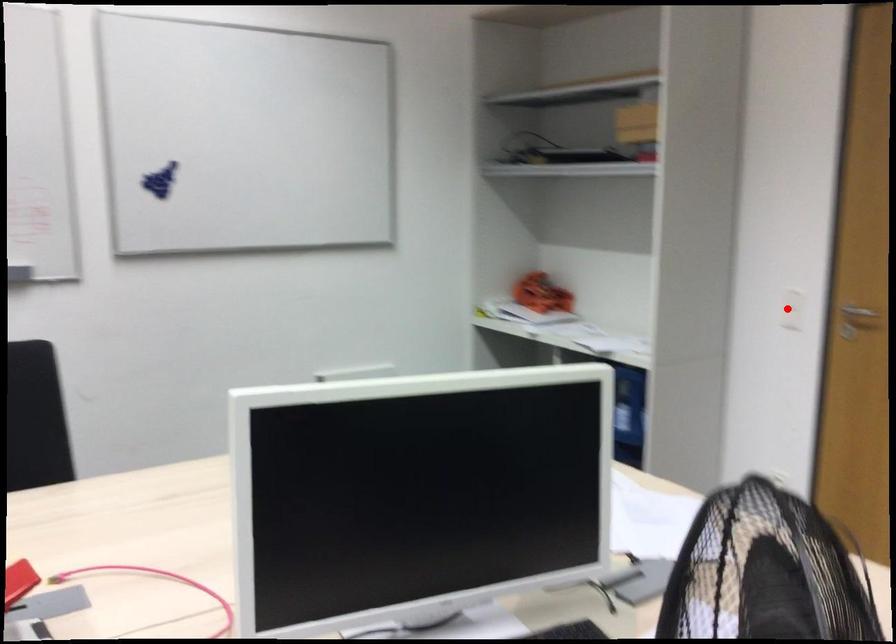
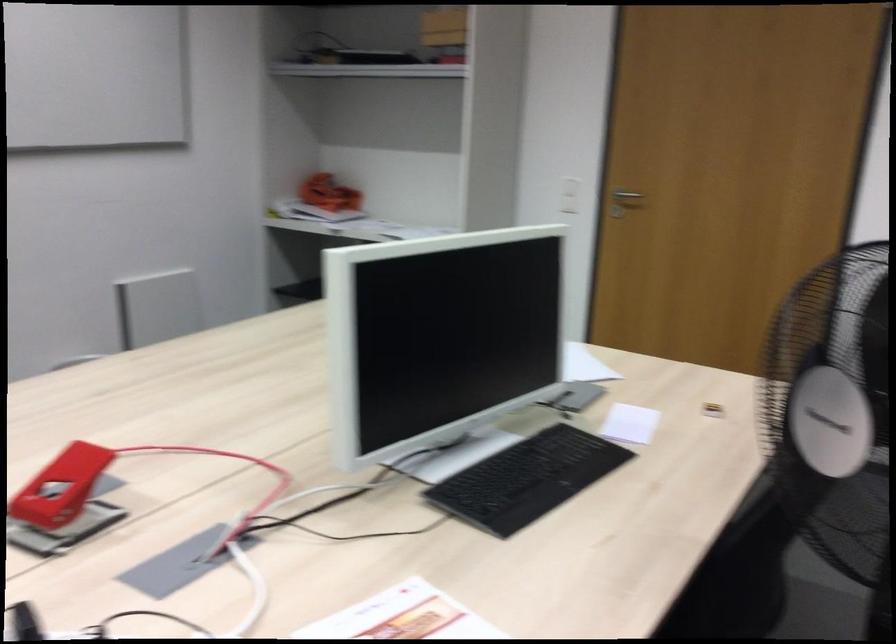
The point at the highlighted location is marked in the first image. Where is the corresponding point in the second image?

(569, 194)